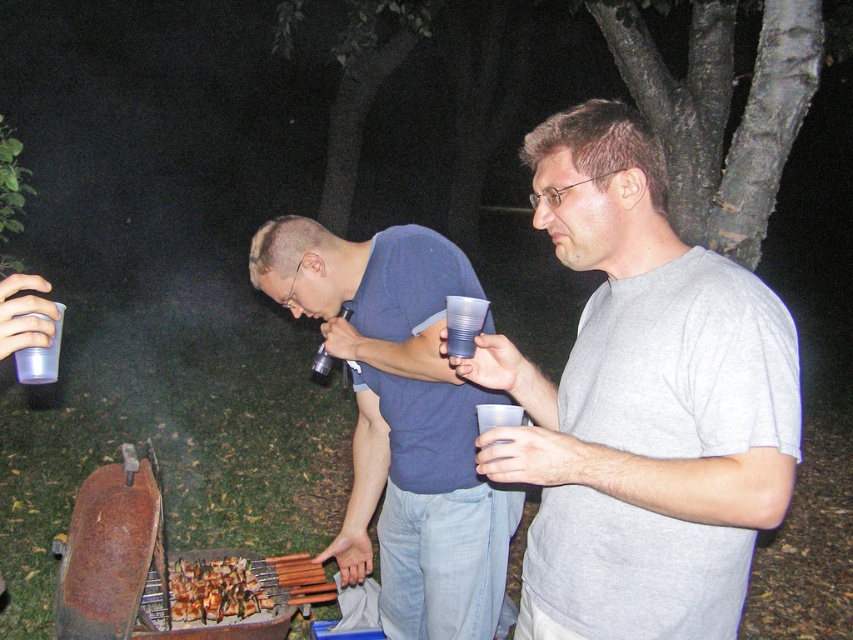
Is grilled meat skewers at center thinner than transparent plastic cup at lower left?

Yes, grilled meat skewers at center is thinner than transparent plastic cup at lower left.

Is point (251, 561) positioned behind point (24, 378)?

Yes, point (251, 561) is behind point (24, 378).

The image size is (853, 640). I want to click on grilled meat skewers at center, so click(x=219, y=588).

Identify the location of grilled meat skewers at center. (219, 588).

Is brown wooden skewers at center bigger than transparent plastic cup at lower left?

Incorrect, brown wooden skewers at center is not larger than transparent plastic cup at lower left.

Is brown wooden skewers at center taller than transparent plastic cup at lower left?

Yes, brown wooden skewers at center is taller than transparent plastic cup at lower left.

I want to click on brown wooden skewers at center, so click(x=292, y=579).

Is blue matte shirt at center shorter than brown wooden skewers at center?

No, blue matte shirt at center is not shorter than brown wooden skewers at center.

Measure the distance between point [364,273] and camera.

The distance of point [364,273] from camera is 7.48 feet.

What do you see at coordinates (401, 420) in the screenshot? The width and height of the screenshot is (853, 640). I see `blue matte shirt at center` at bounding box center [401, 420].

Locate an element on the screen. The width and height of the screenshot is (853, 640). blue matte shirt at center is located at coordinates (401, 420).